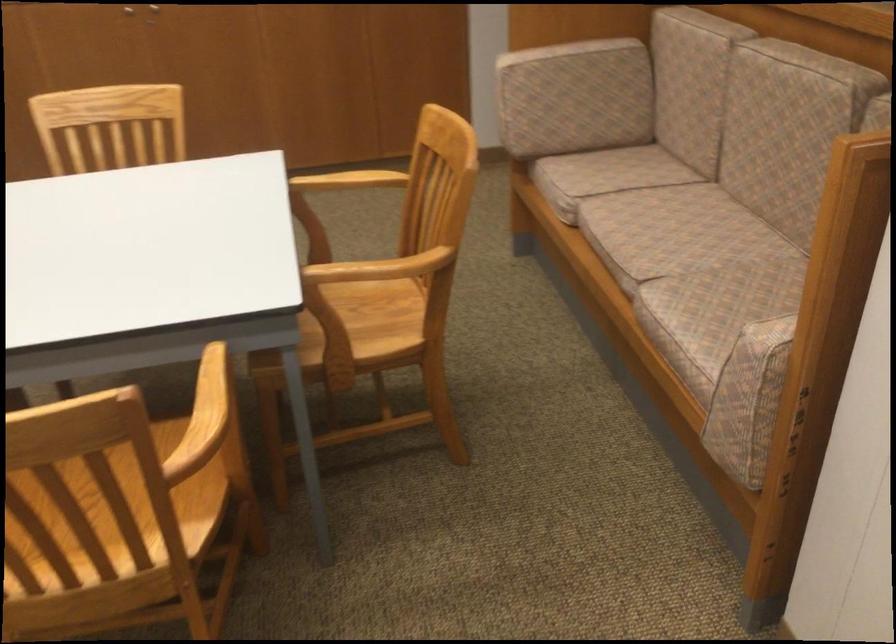
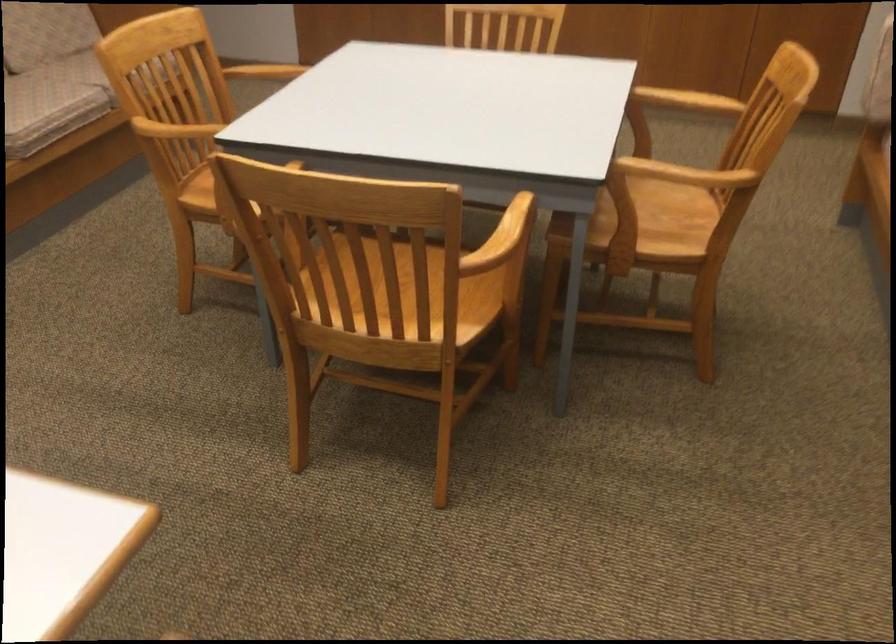
Question: Based on the continuous images, in which direction is the camera rotating? Reply with the corresponding letter.

Choices:
 (A) Left
 (B) Right
 (C) Up
 (D) Down

Answer: (A)